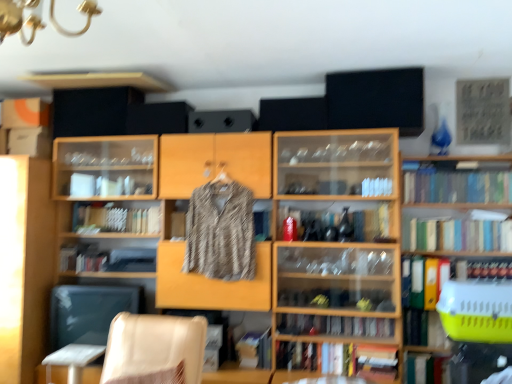
Question: Does green matte book at lower right, the first book from the bottom, turn towards wooden bookcase at center?

Choices:
 (A) no
 (B) yes

Answer: (A)

Question: From a real-world perspective, is green matte book at lower right, the first book from the bottom, under wooden bookcase at center?

Choices:
 (A) no
 (B) yes

Answer: (B)

Question: Can you confirm if green matte book at lower right, the first book from the bottom, is positioned to the left of wooden bookcase at center?

Choices:
 (A) yes
 (B) no

Answer: (B)

Question: Does green matte book at lower right, the first book from the bottom, have a lesser height compared to wooden bookcase at center?

Choices:
 (A) no
 (B) yes

Answer: (B)

Question: Can we say green matte book at lower right, the eighth book viewed from the top, lies outside wooden bookcase at center?

Choices:
 (A) yes
 (B) no

Answer: (A)

Question: From a real-world perspective, is hardcover book at lower center, the seventh book when ordered from top to bottom, above or below wooden cabinet at left, marked as the 3th shelf in a right-to-left arrangement?

Choices:
 (A) above
 (B) below

Answer: (B)

Question: Is hardcover book at lower center, the 2th book when ordered from bottom to top, wider or thinner than wooden cabinet at left, marked as the 3th shelf in a right-to-left arrangement?

Choices:
 (A) thin
 (B) wide

Answer: (A)

Question: Considering the positions of hardcover book at lower center, the 2th book when ordered from bottom to top, and wooden cabinet at left, positioned as the first shelf in left-to-right order, in the image, is hardcover book at lower center, the 2th book when ordered from bottom to top, taller or shorter than wooden cabinet at left, positioned as the first shelf in left-to-right order,?

Choices:
 (A) short
 (B) tall

Answer: (A)

Question: Is hardcover book at lower center, the seventh book when ordered from top to bottom, in front of or behind wooden cabinet at left, marked as the 3th shelf in a right-to-left arrangement, in the image?

Choices:
 (A) front
 (B) behind

Answer: (A)

Question: Looking at their shapes, would you say striped fabric shirt at center is wider or thinner than patterned fabric shirt at center, which appears as the 2th shelf when viewed from the left?

Choices:
 (A) thin
 (B) wide

Answer: (A)

Question: Visually, is striped fabric shirt at center positioned to the left or to the right of patterned fabric shirt at center, which appears as the 2th shelf when viewed from the left?

Choices:
 (A) right
 (B) left

Answer: (A)

Question: Relative to patterned fabric shirt at center, which is the second shelf from right to left, is striped fabric shirt at center in front or behind?

Choices:
 (A) front
 (B) behind

Answer: (A)

Question: Is striped fabric shirt at center spatially inside patterned fabric shirt at center, which appears as the 2th shelf when viewed from the left, or outside of it?

Choices:
 (A) outside
 (B) inside

Answer: (A)

Question: Is point (349, 322) positioned closer to the camera than point (468, 200)?

Choices:
 (A) closer
 (B) farther

Answer: (B)

Question: From the image's perspective, is hardcover book at center, the 6th book when ordered from top to bottom, located above or below green matte bookshelf at right, acting as the 1th book starting from the top?

Choices:
 (A) below
 (B) above

Answer: (A)